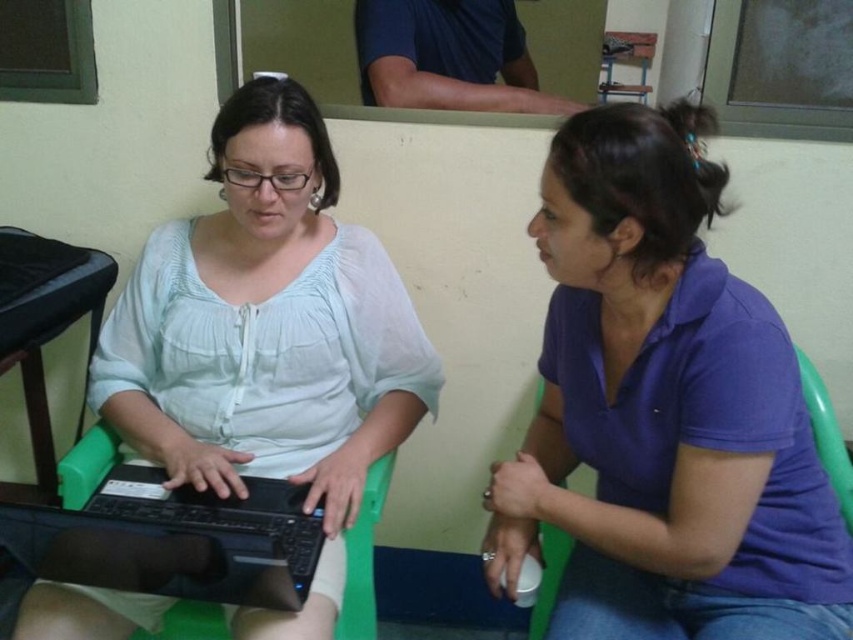
You are sitting on the green plastic chair at lower left and want to move to the green plastic chair at lower right. Which direction should you move to reach it?

The green plastic chair at lower left is positioned on the left side of the green plastic chair at lower right, so you should move to the right to reach it.

You are standing in the room and want to determine which of the two points, point (769, 492) or point (322, 312), is closer to you. Based on the scene description, which point is nearer?

Point (769, 492) is closer to the viewer than point (322, 312).